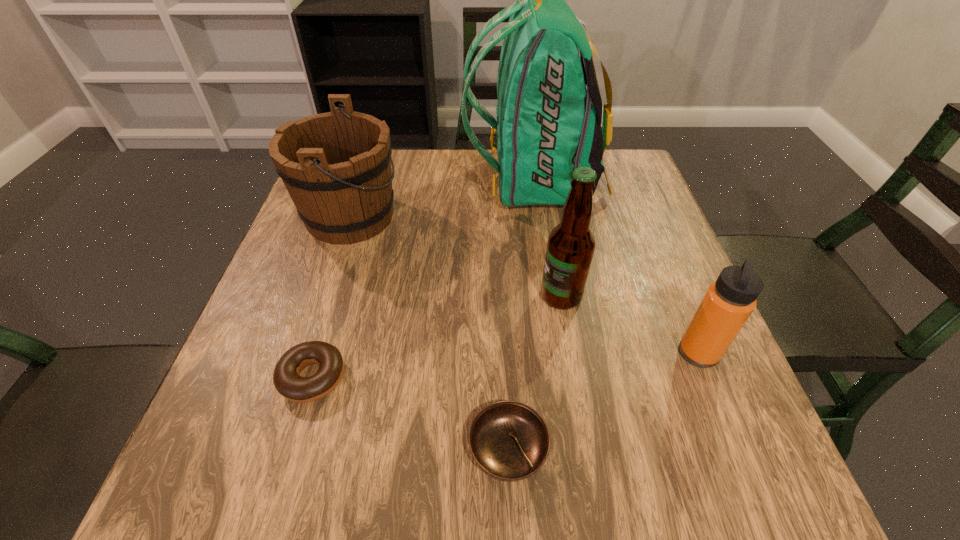
Identify the location of wine bucket present at the left edge. (336, 166).

This screenshot has height=540, width=960. I want to click on doughnut that is at the left edge, so click(286, 377).

Locate an element on the screen. The image size is (960, 540). backpack that is at the right edge is located at coordinates (548, 124).

Where is `thermos bottle at the right edge`? This screenshot has width=960, height=540. thermos bottle at the right edge is located at coordinates (729, 301).

The width and height of the screenshot is (960, 540). What are the coordinates of `object that is at the far left corner` in the screenshot? It's located at (336, 166).

I want to click on object that is at the far right corner, so [548, 124].

In the image, there is a desktop. At what (x,y) coordinates should I click in order to perform the action: click on free region at the far edge. Please return your answer as a coordinate pair (x, y). Looking at the image, I should click on (468, 164).

In the image, there is a desktop. In order to click on free region at the near edge in this screenshot , I will do `click(652, 448)`.

Find the location of a particular element. This screenshot has height=540, width=960. vacant region at the left edge is located at coordinates (340, 254).

At what (x,y) coordinates should I click in order to perform the action: click on vacant region at the right edge of the desktop. Please return your answer as a coordinate pair (x, y). Image resolution: width=960 pixels, height=540 pixels. Looking at the image, I should click on (693, 286).